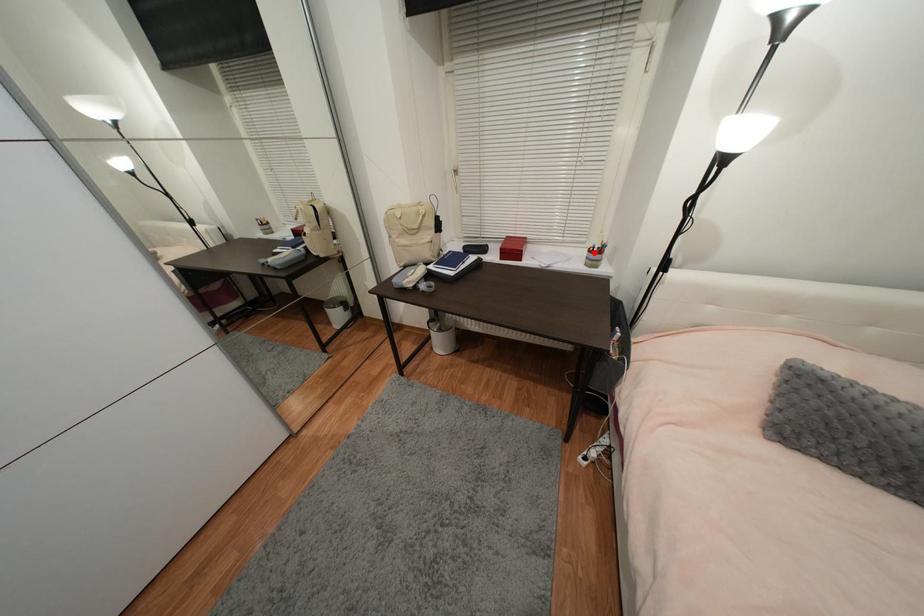
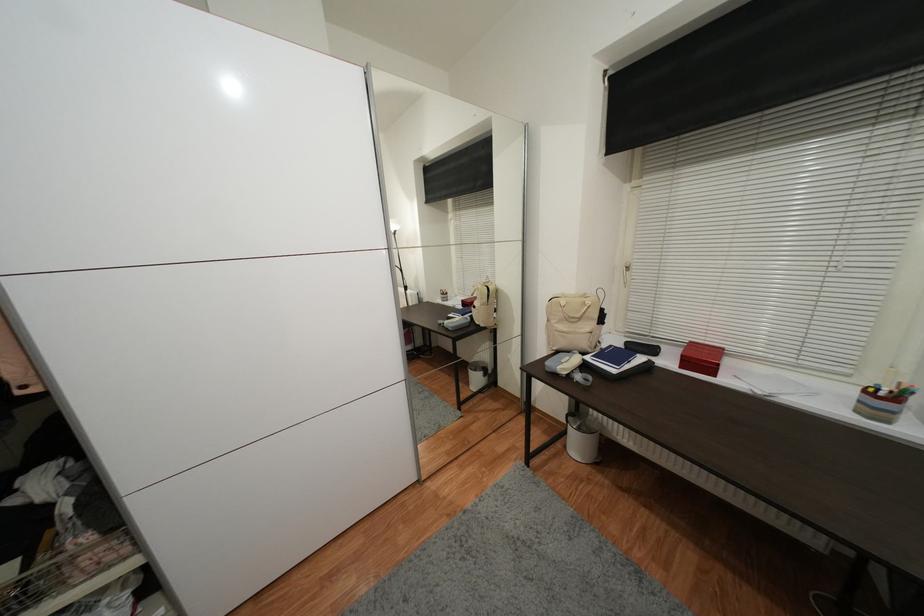
Locate, in the second image, the point that corresponds to the highlighted location in the first image.

(871, 392)